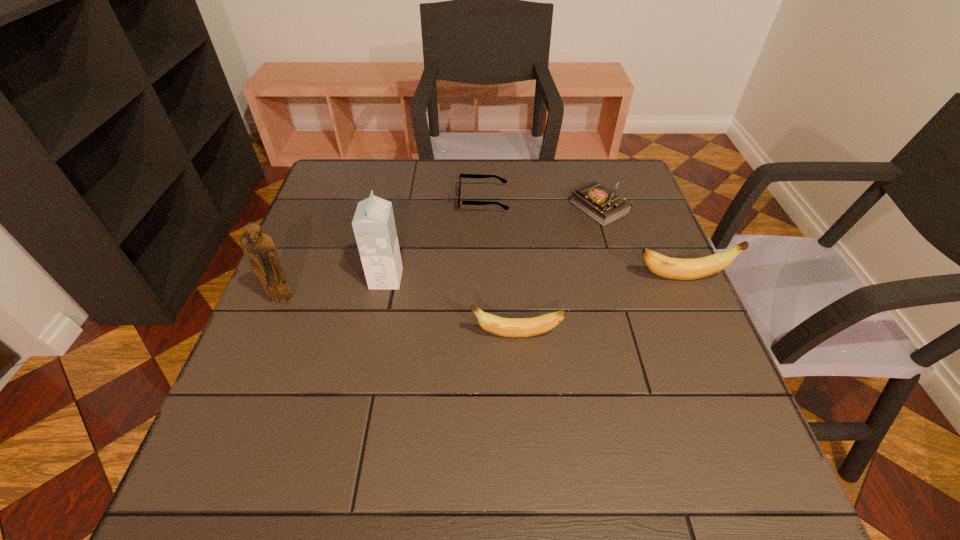
What are the coordinates of `the nearest object` in the screenshot? It's located at (507, 327).

You are a GUI agent. You are given a task and a screenshot of the screen. Output one action in this format:
    pyautogui.click(x=<x>, y=<y>)
    Task: Click on the nearer banana
    The height and width of the screenshot is (540, 960).
    Given the screenshot: What is the action you would take?
    pyautogui.click(x=507, y=327)

Where is `the right banana`? the right banana is located at coordinates (674, 268).

You are a GUI agent. You are given a task and a screenshot of the screen. Output one action in this format:
    pyautogui.click(x=<x>, y=<y>)
    Task: Click on the fourth shortest object
    The width and height of the screenshot is (960, 540).
    Given the screenshot: What is the action you would take?
    pyautogui.click(x=674, y=268)

You are a GUI agent. You are given a task and a screenshot of the screen. Output one action in this format:
    pyautogui.click(x=<x>, y=<y>)
    Task: Click on the spectacles
    The image size is (960, 540).
    Given the screenshot: What is the action you would take?
    pyautogui.click(x=504, y=181)

I want to click on diary, so click(x=602, y=205).

Image resolution: width=960 pixels, height=540 pixels. I want to click on the fifth object from right to left, so click(374, 227).

Where is `figurine`? The width and height of the screenshot is (960, 540). figurine is located at coordinates (259, 246).

You are a GUI agent. You are given a task and a screenshot of the screen. Output one action in this format:
    pyautogui.click(x=<x>, y=<y>)
    Task: Click on the second nearest object
    
    Given the screenshot: What is the action you would take?
    pyautogui.click(x=259, y=246)

The width and height of the screenshot is (960, 540). Identify the location of vacant area located 0.100m at the stem of the nearest object. (423, 335).